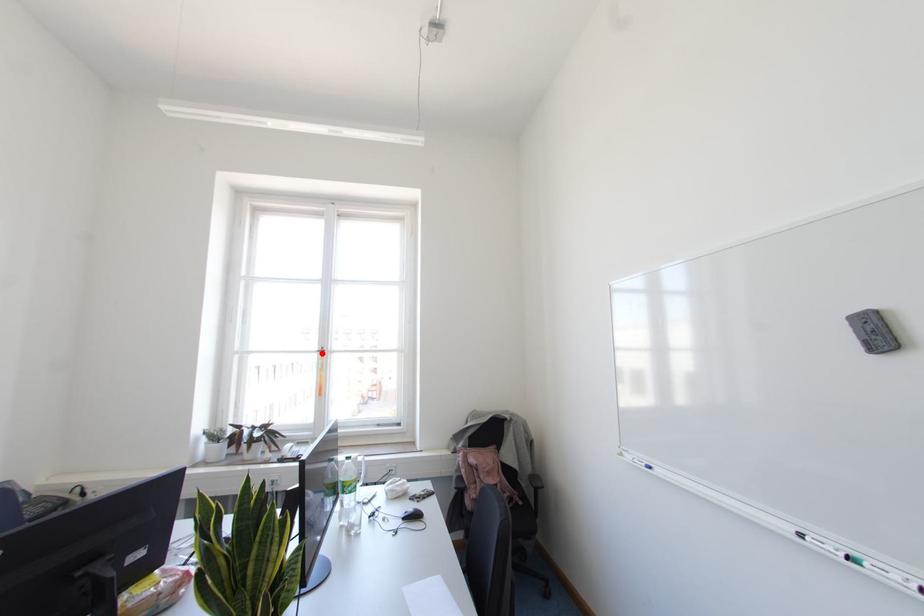
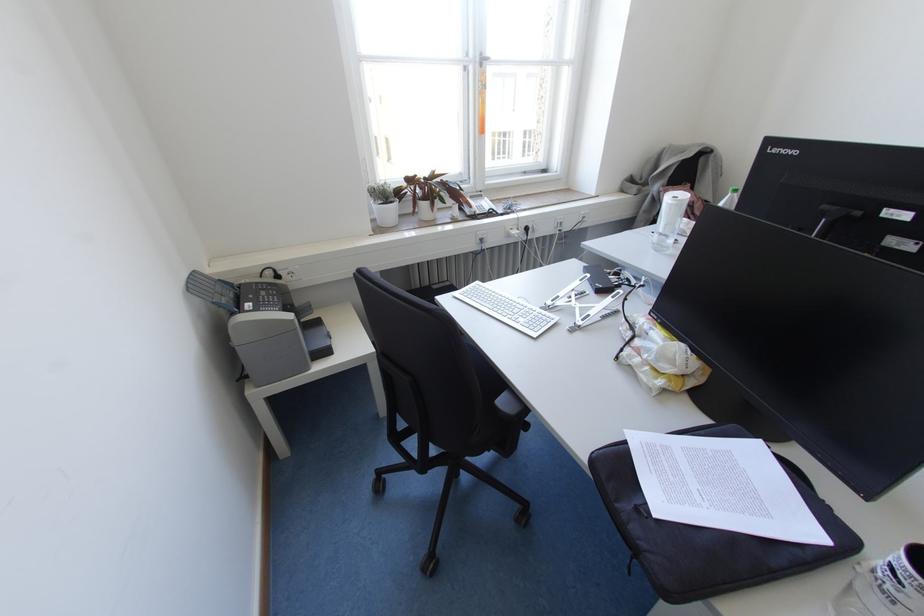
Question: A red point is marked in image1. In image2, is the corresponding 3D point closer to the camera or farther? Reply with the corresponding letter.

Choices:
 (A) The corresponding 3D point is closer.
 (B) The corresponding 3D point is farther.

Answer: (A)